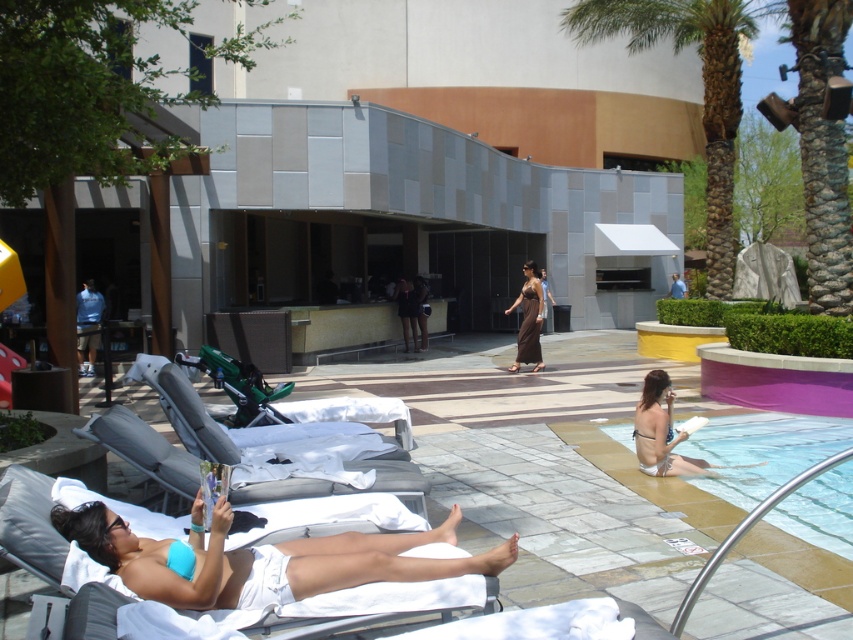
Question: Is white fabric chair at lower left bigger than light blue fabric shirt at center?

Choices:
 (A) no
 (B) yes

Answer: (A)

Question: Does clear blue water at lower right come in front of white fabric chair at lower left?

Choices:
 (A) yes
 (B) no

Answer: (B)

Question: Which object is closer to the camera taking this photo?

Choices:
 (A) light blue fabric shorts at left
 (B) green plastic chair at center

Answer: (B)

Question: Can you confirm if white fabric chair at lower left is wider than white bikini at lower right?

Choices:
 (A) no
 (B) yes

Answer: (A)

Question: Considering the real-world distances, which object is farthest from the white bikini at lower right?

Choices:
 (A) light blue fabric shirt at center
 (B) brown satin dress at center
 (C) shiny brown dress at center
 (D) green leafy palm tree at upper right

Answer: (A)

Question: Which of these objects is positioned farthest from the green plastic chair at center?

Choices:
 (A) green leafy palm tree at upper right
 (B) shiny brown dress at center

Answer: (A)